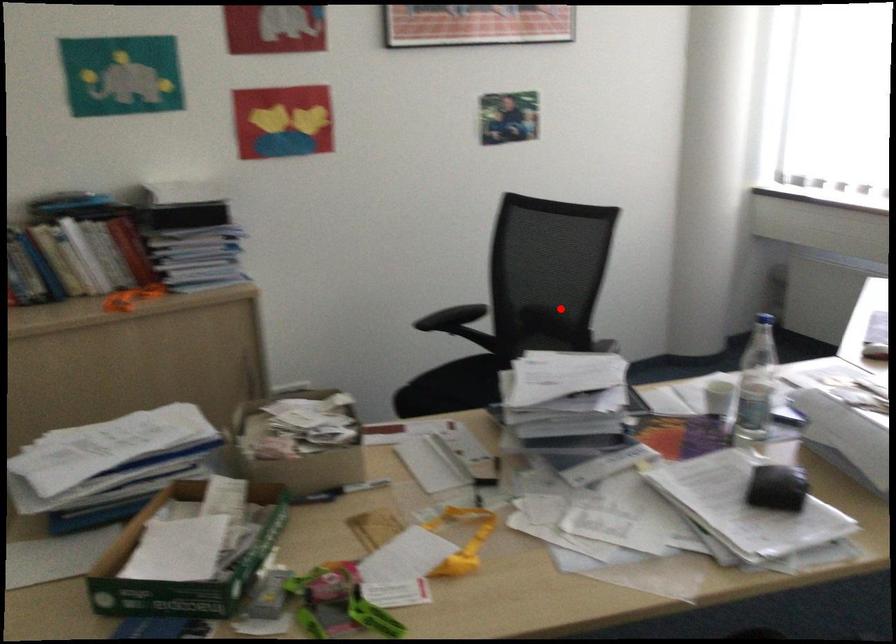
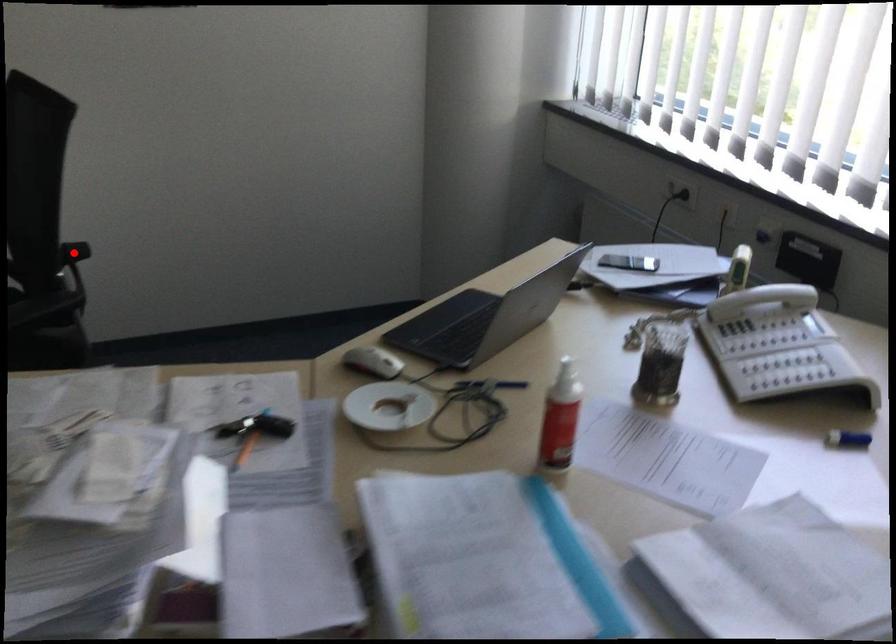
I am providing you with two images of the same scene from different viewpoints. A red point is marked on the first image and another point is marked on the second image. Are the points marked in image1 and image2 representing the same 3D position?

Yes